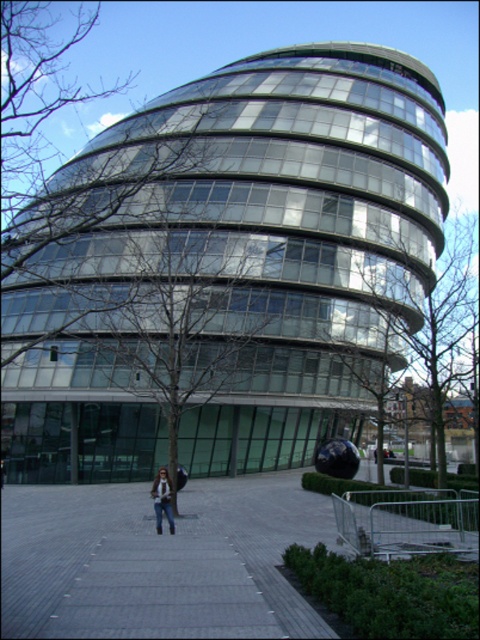
Question: Does gray concrete pavement at center appear under denim jacket at center?

Choices:
 (A) no
 (B) yes

Answer: (B)

Question: Can you confirm if gray concrete pavement at center is thinner than green leafy tree at center?

Choices:
 (A) no
 (B) yes

Answer: (B)

Question: Which of these objects is positioned closest to the green leafy tree at center?

Choices:
 (A) denim jacket at center
 (B) gray concrete pavement at center

Answer: (B)

Question: Which point is closer to the camera?

Choices:
 (A) (168, 516)
 (B) (335, 541)
 (C) (381, 461)

Answer: (B)

Question: Which point appears closest to the camera in this image?

Choices:
 (A) (172, 522)
 (B) (117, 496)

Answer: (A)

Question: Can you confirm if gray concrete pavement at center is smaller than denim jacket at center?

Choices:
 (A) no
 (B) yes

Answer: (A)